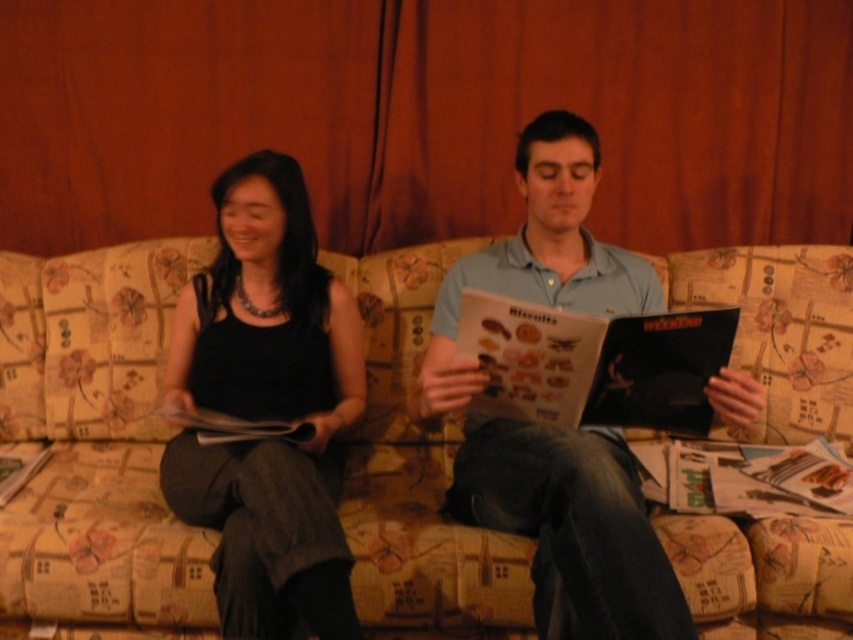
Is black fabric dress at center taller than light blue cotton shirt at center?

No, black fabric dress at center is not taller than light blue cotton shirt at center.

Image resolution: width=853 pixels, height=640 pixels. I want to click on black fabric dress at center, so click(x=267, y=408).

Is point (318, 413) farther from viewer compared to point (556, 618)?

That is True.

Where is `black fabric dress at center`? This screenshot has height=640, width=853. black fabric dress at center is located at coordinates (267, 408).

Who is taller, floral fabric couch at center or light blue cotton shirt at center?

Standing taller between the two is light blue cotton shirt at center.

Between floral fabric couch at center and light blue cotton shirt at center, which one appears on the right side from the viewer's perspective?

From the viewer's perspective, light blue cotton shirt at center appears more on the right side.

Does point (396, 550) lie behind point (543, 522)?

Yes.

The height and width of the screenshot is (640, 853). What are the coordinates of `floral fabric couch at center` in the screenshot? It's located at (96, 442).

Can you confirm if floral fabric couch at center is positioned to the left of black fabric dress at center?

Yes, floral fabric couch at center is to the left of black fabric dress at center.

Who is more forward, (730, 612) or (311, 611)?

Positioned in front is point (311, 611).

Where is `floral fabric couch at center`? floral fabric couch at center is located at coordinates (96, 442).

In order to click on floral fabric couch at center in this screenshot , I will do `click(96, 442)`.